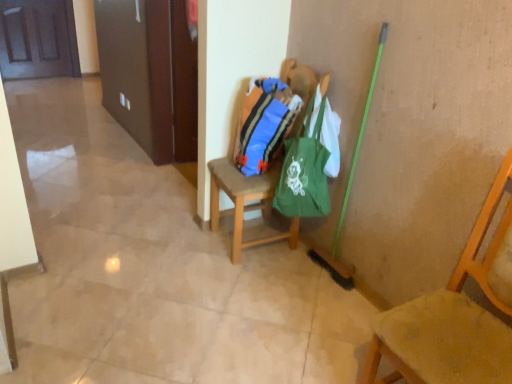
Question: In the image, is wooden chair at center, which is the first chair in left-to-right order, positioned in front of or behind green canvas tote at center?

Choices:
 (A) behind
 (B) front

Answer: (A)

Question: From the image's perspective, relative to green canvas tote at center, is wooden chair at center, positioned as the second chair in front-to-back order, above or below?

Choices:
 (A) below
 (B) above

Answer: (B)

Question: Which object is the farthest from the wooden door at upper left?

Choices:
 (A) wooden chair at right, which appears as the second chair when viewed from the back
 (B) wooden chair at center, which is counted as the first chair, starting from the back
 (C) green canvas tote at center
 (D) blue striped fabric bag at center

Answer: (A)

Question: Which object is the closest to the wooden chair at center, which ranks as the 2th chair in right-to-left order?

Choices:
 (A) green canvas tote at center
 (B) blue striped fabric bag at center
 (C) wooden door at upper left
 (D) wooden chair at right, the 2th chair viewed from the left

Answer: (B)